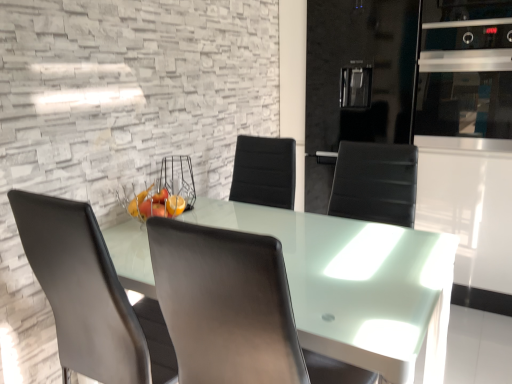
What do you see at coordinates (233, 309) in the screenshot? Image resolution: width=512 pixels, height=384 pixels. I see `black leather chair at center, positioned as the 1th chair in right-to-left order` at bounding box center [233, 309].

Identify the location of matte gray chair at center, the first chair positioned from the left. This screenshot has width=512, height=384. (90, 296).

The image size is (512, 384). Identify the location of black leather chair at center, arranged as the second chair when viewed from the left. (233, 309).

Does point (250, 266) appear closer or farther from the camera than point (464, 81)?

Point (250, 266) is positioned closer to the camera compared to point (464, 81).

Between black leather chair at center, positioned as the 1th chair in right-to-left order, and satin silver oven at upper right, which one has larger width?

black leather chair at center, positioned as the 1th chair in right-to-left order.

Relative to satin silver oven at upper right, is black leather chair at center, positioned as the 1th chair in right-to-left order, in front or behind?

In the image, black leather chair at center, positioned as the 1th chair in right-to-left order, appears in front of satin silver oven at upper right.

In the image, is black leather chair at center, positioned as the 1th chair in right-to-left order, on the left side or the right side of satin silver oven at upper right?

Result: Based on their positions, black leather chair at center, positioned as the 1th chair in right-to-left order, is located to the left of satin silver oven at upper right.

Which of these two, matte gray chair at center, the first chair positioned from the left, or black leather chair at center, arranged as the second chair when viewed from the left, is smaller?

With smaller size is matte gray chair at center, the first chair positioned from the left.

Is matte gray chair at center, the 2th chair in the right-to-left sequence, not close to black leather chair at center, positioned as the 1th chair in right-to-left order?

matte gray chair at center, the 2th chair in the right-to-left sequence, is near black leather chair at center, positioned as the 1th chair in right-to-left order, not far away.

Can you confirm if matte gray chair at center, the first chair positioned from the left, is shorter than black leather chair at center, positioned as the 1th chair in right-to-left order?

No.

Is matte gray chair at center, the 2th chair in the right-to-left sequence, to the right of black leather chair at center, positioned as the 1th chair in right-to-left order, from the viewer's perspective?

No.

Is satin silver oven at upper right facing away from matte gray chair at center, the first chair positioned from the left?

No.

This screenshot has width=512, height=384. Find the location of `chair that is the 2nd object located below the satin silver oven at upper right (from the image's perspective)`. chair that is the 2nd object located below the satin silver oven at upper right (from the image's perspective) is located at coordinates (90, 296).

From a real-world perspective, is satin silver oven at upper right on matte gray chair at center, the first chair positioned from the left?

Yes, from a real-world perspective, satin silver oven at upper right is over matte gray chair at center, the first chair positioned from the left

From the image's perspective, is black leather chair at center, positioned as the 1th chair in right-to-left order, under matte gray chair at center, the 2th chair in the right-to-left sequence?

Incorrect, from the image's perspective, black leather chair at center, positioned as the 1th chair in right-to-left order, is higher than matte gray chair at center, the 2th chair in the right-to-left sequence.

Which object is further away from the camera taking this photo, black leather chair at center, arranged as the second chair when viewed from the left, or matte gray chair at center, the first chair positioned from the left?

matte gray chair at center, the first chair positioned from the left, is more distant.

Can you confirm if black leather chair at center, positioned as the 1th chair in right-to-left order, is smaller than matte gray chair at center, the first chair positioned from the left?

No, black leather chair at center, positioned as the 1th chair in right-to-left order, is not smaller than matte gray chair at center, the first chair positioned from the left.

Where is `chair that appears below the black leather chair at center, positioned as the 1th chair in right-to-left order (from the image's perspective)`? The image size is (512, 384). chair that appears below the black leather chair at center, positioned as the 1th chair in right-to-left order (from the image's perspective) is located at coordinates (90, 296).

Is matte gray chair at center, the first chair positioned from the left, directly adjacent to satin silver oven at upper right?

They are not placed beside each other.

From the image's perspective, is matte gray chair at center, the 2th chair in the right-to-left sequence, above satin silver oven at upper right?

Actually, matte gray chair at center, the 2th chair in the right-to-left sequence, appears below satin silver oven at upper right in the image.

Is matte gray chair at center, the 2th chair in the right-to-left sequence, thinner than satin silver oven at upper right?

In fact, matte gray chair at center, the 2th chair in the right-to-left sequence, might be wider than satin silver oven at upper right.

Considering the positions of objects matte gray chair at center, the first chair positioned from the left, and satin silver oven at upper right in the image provided, who is more to the left, matte gray chair at center, the first chair positioned from the left, or satin silver oven at upper right?

matte gray chair at center, the first chair positioned from the left, is more to the left.

Does satin silver oven at upper right have a greater width compared to black leather chair at center, arranged as the second chair when viewed from the left?

No, satin silver oven at upper right is not wider than black leather chair at center, arranged as the second chair when viewed from the left.

Is satin silver oven at upper right in front of black leather chair at center, positioned as the 1th chair in right-to-left order?

No, it is behind black leather chair at center, positioned as the 1th chair in right-to-left order.

Is point (476, 78) less distant than point (213, 345)?

No, (476, 78) is behind (213, 345).

Where is `appliance that is behind the black leather chair at center, positioned as the 1th chair in right-to-left order`? appliance that is behind the black leather chair at center, positioned as the 1th chair in right-to-left order is located at coordinates (465, 69).

In the image, there is a black leather chair at center, arranged as the second chair when viewed from the left. Identify the location of chair below it (from the image's perspective). (90, 296).

From the image, which object appears to be nearer to satin silver oven at upper right, matte gray chair at center, the first chair positioned from the left, or black leather chair at center, positioned as the 1th chair in right-to-left order?

Among the two, black leather chair at center, positioned as the 1th chair in right-to-left order, is located nearer to satin silver oven at upper right.

In the scene shown: From the image, which object appears to be farther from black leather chair at center, positioned as the 1th chair in right-to-left order, matte gray chair at center, the first chair positioned from the left, or satin silver oven at upper right?

The object further to black leather chair at center, positioned as the 1th chair in right-to-left order, is satin silver oven at upper right.

Considering their positions, is satin silver oven at upper right positioned closer to matte gray chair at center, the 2th chair in the right-to-left sequence, than black leather chair at center, positioned as the 1th chair in right-to-left order?

Among the two, black leather chair at center, positioned as the 1th chair in right-to-left order, is located nearer to matte gray chair at center, the 2th chair in the right-to-left sequence.

When comparing their distances from black leather chair at center, positioned as the 1th chair in right-to-left order, does satin silver oven at upper right or matte gray chair at center, the first chair positioned from the left, seem further?

satin silver oven at upper right is further to black leather chair at center, positioned as the 1th chair in right-to-left order.

Estimate the real-world distances between objects in this image. Which object is further from satin silver oven at upper right, black leather chair at center, arranged as the second chair when viewed from the left, or matte gray chair at center, the 2th chair in the right-to-left sequence?

matte gray chair at center, the 2th chair in the right-to-left sequence, is positioned further to the anchor satin silver oven at upper right.

Which object lies nearer to the anchor point matte gray chair at center, the first chair positioned from the left, black leather chair at center, positioned as the 1th chair in right-to-left order, or satin silver oven at upper right?

black leather chair at center, positioned as the 1th chair in right-to-left order.

At what (x,y) coordinates should I click in order to perform the action: click on chair between matte gray chair at center, the first chair positioned from the left, and satin silver oven at upper right, in the horizontal direction. Please return your answer as a coordinate pair (x, y). This screenshot has width=512, height=384. Looking at the image, I should click on (233, 309).